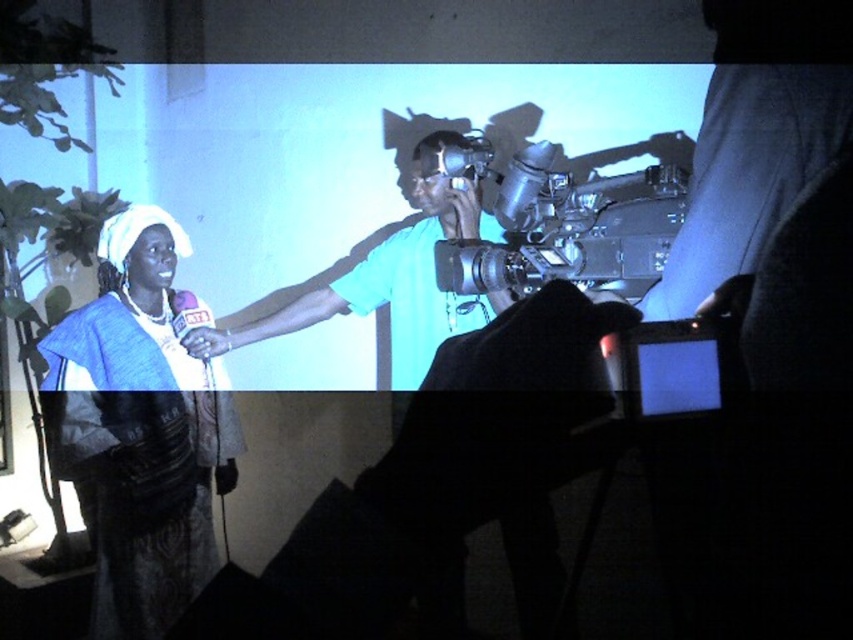
You are a photographer standing in front of the projection screen. You need to capture a photo of both the matte blue dress at left and the metallic silver video camera at center. Based on their sizes, which object will appear larger in your photo?

The matte blue dress at left will appear larger in the photo because it is much taller than the metallic silver video camera at center.

From the picture: You are a photographer adjusting lighting for a photo shoot. You need to ensure that the matte blue dress at left and the teal matte camera at center are both well lit. Given their sizes, which object requires a wider light source to adequately illuminate its entire surface?

The matte blue dress at left is taller than the teal matte camera at center, so it requires a wider light source to adequately illuminate its entire surface.

You are an event organizer who needs to set up a camera for a live stream. The metallic silver video camera at center is located at point coordinates of (x=560, y=224). Where should you place the camera to ensure it captures the entire scene? Please provide coordinates in the format of x,y between 0 and 1.

The metallic silver video camera at center is located at point coordinates of (x=560, y=224). To capture the entire scene, the camera should be placed at the center coordinates of (x=560, y=224) as specified.